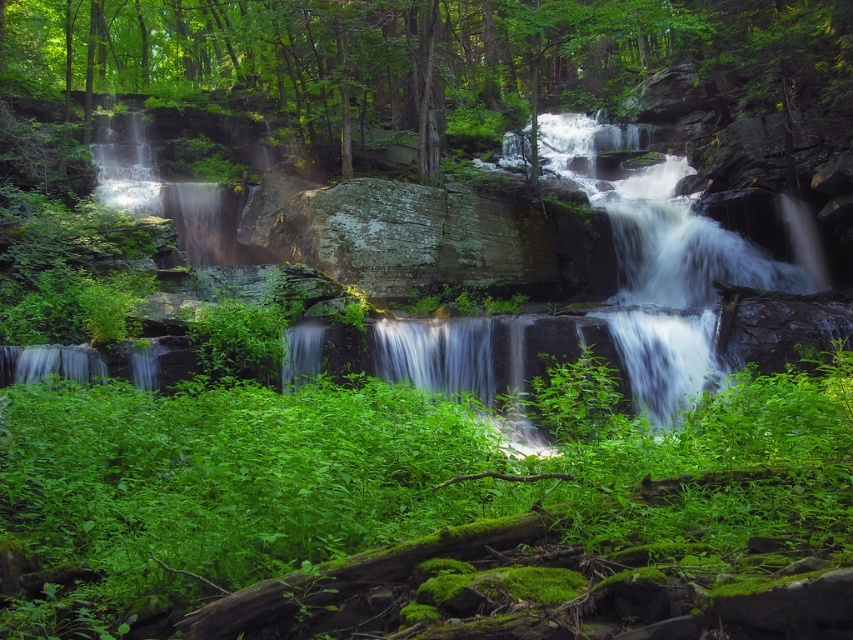
You are a hiker who wants to take a photo of the green leafy plants at center and the green leafy tree at upper center. Which one should you zoom in on to capture more details of its leaves?

The green leafy plants at center is smaller than the green leafy tree at upper center, so you should zoom in on the green leafy plants at center to capture more details of its leaves since it is closer in size and requires magnification for clarity.